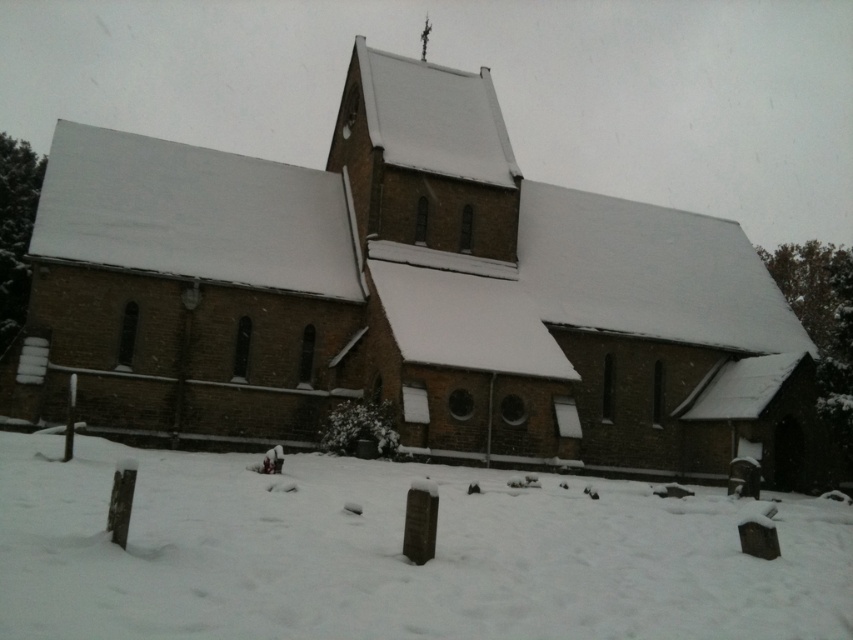
You are standing in a winter landscape and see the brown brick church at center and the white powdery snow at lower center. Which object is positioned to the right side?

The white powdery snow at lower center is positioned to the right side of the brown brick church at center.

You are standing in front of the brown brick church at center and want to walk to the white powdery snow at lower center. Which direction should you move to reach the snow?

You should move forward towards the white powdery snow at lower center because the brown brick church at center is closer to you, so the snow is in front of you.